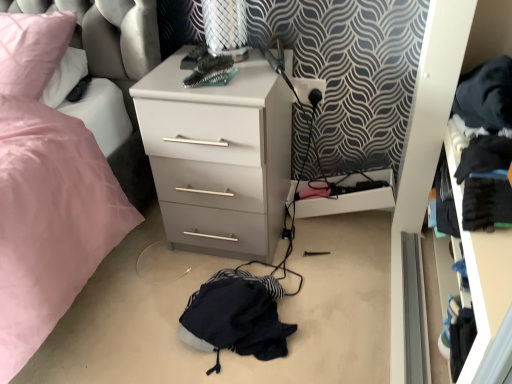
At what (x,y) coordinates should I click in order to perform the action: click on vacant area that lies in front of matte gray chest of drawers at center. Please return your answer as a coordinate pair (x, y). This screenshot has height=384, width=512. Looking at the image, I should click on (188, 292).